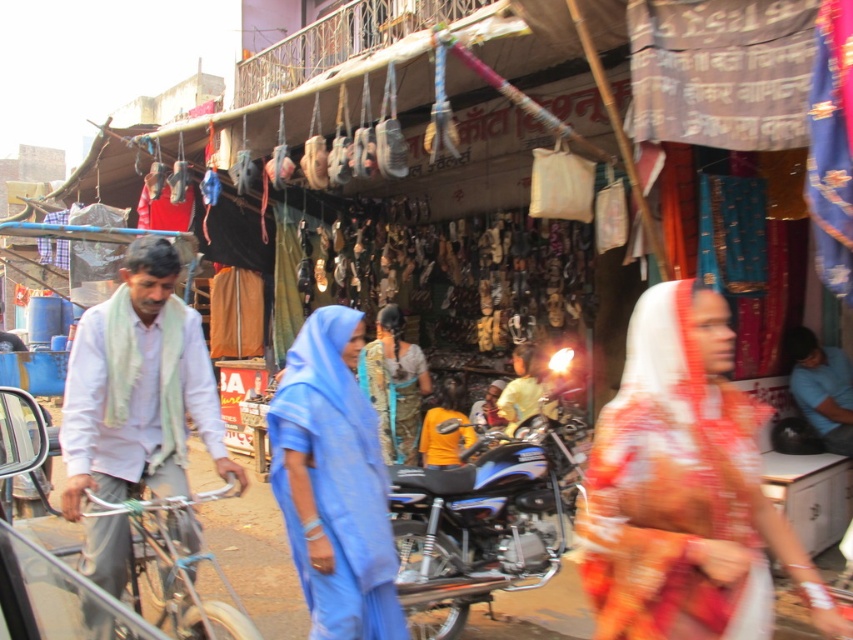
Who is shorter, blue fabric headscarf at center or yellow fabric shirt at center?

Standing shorter between the two is yellow fabric shirt at center.

Which is in front, point (302, 556) or point (524, 381)?

Positioned in front is point (302, 556).

Locate an element on the screen. The width and height of the screenshot is (853, 640). blue fabric headscarf at center is located at coordinates (334, 483).

Who is positioned more to the right, shiny metallic motorcycle at center or blue fabric headscarf at upper center?

blue fabric headscarf at upper center

Is shiny metallic motorcycle at center above blue fabric headscarf at upper center?

No.

Does point (447, 605) come farther from viewer compared to point (848, 429)?

No, (447, 605) is closer to viewer.

Locate an element on the screen. shiny metallic motorcycle at center is located at coordinates (476, 516).

Between blue fabric headscarf at center and shiny metallic motorcycle at center, which one is positioned lower?

Positioned lower is shiny metallic motorcycle at center.

Which is behind, point (335, 563) or point (434, 570)?

Positioned behind is point (434, 570).

Who is more forward, (383, 593) or (526, 557)?

Point (383, 593) is more forward.

At what (x,y) coordinates should I click in order to perform the action: click on blue fabric headscarf at center. Please return your answer as a coordinate pair (x, y). This screenshot has width=853, height=640. Looking at the image, I should click on (334, 483).